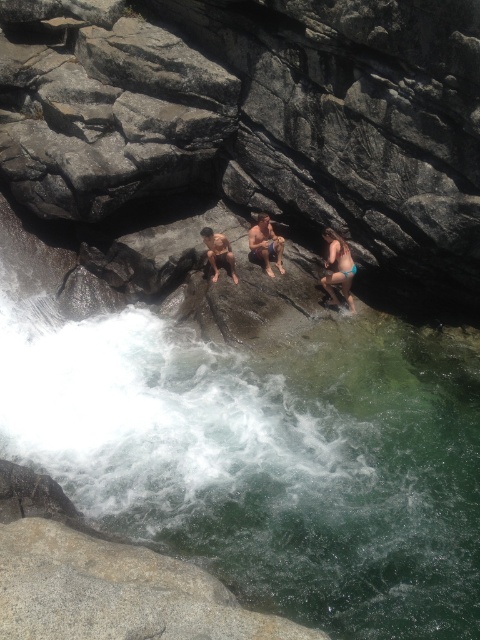
You are standing at the edge of the rocky ledge and want to take a photo of both the tan skin human at center and the smooth tan skin at center. Which one should you focus on first to ensure they are both in clear view?

You should focus on the tan skin human at center first because it is closer to you than the smooth tan skin at center, ensuring both are in clear view.

You are standing on the rocky ledge and want to take a photo of the clear water at center. Where should you aim your camera to capture it?

You should aim your camera at point 0.720 on the horizontal axis and 0.556 on the vertical axis to capture the clear water at center.